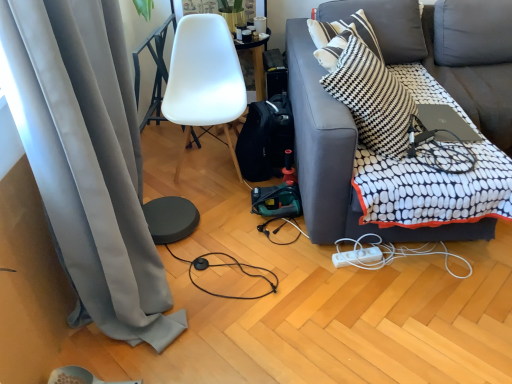
This screenshot has width=512, height=384. In order to click on vacant space underneath white matte chair at center (from a real-world perspective) in this screenshot , I will do `click(207, 167)`.